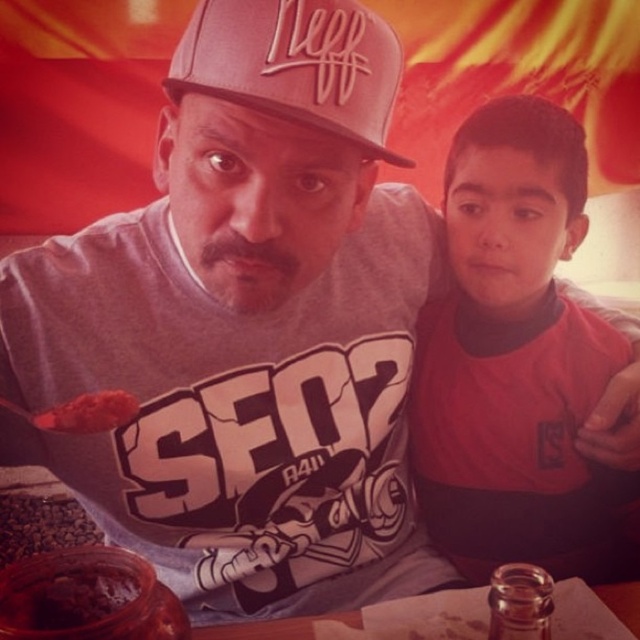
Question: Does matte pink baseball cap at center appear over brown matte coffee beans at lower left?

Choices:
 (A) no
 (B) yes

Answer: (B)

Question: Does brown matte coffee beans at lower left appear under smooth tomato sauce at center?

Choices:
 (A) yes
 (B) no

Answer: (A)

Question: Which point is farther to the camera?

Choices:
 (A) matte red shirt at center
 (B) smooth tomato sauce at center
 (C) brown matte coffee beans at lower left
 (D) matte pink baseball cap at center

Answer: (C)

Question: Which point is closer to the camera?

Choices:
 (A) (250, 64)
 (B) (58, 429)
 (C) (509, 467)
 (D) (48, 529)

Answer: (A)

Question: Is matte pink baseball cap at center wider than brown matte coffee beans at lower left?

Choices:
 (A) no
 (B) yes

Answer: (A)

Question: Which of these objects is positioned farthest from the smooth tomato sauce at center?

Choices:
 (A) brown matte coffee beans at lower left
 (B) matte pink baseball cap at center

Answer: (A)